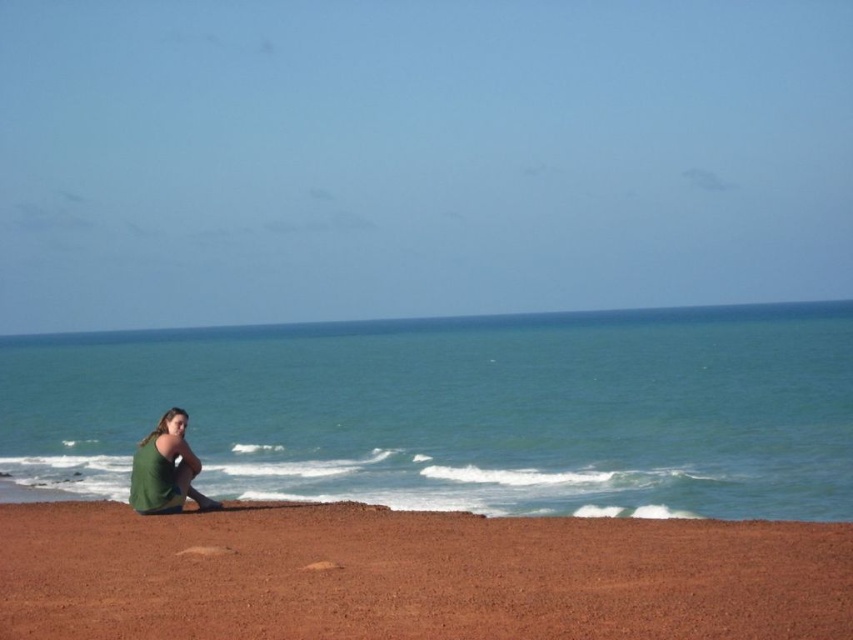
Can you confirm if green water at center is bigger than reddish-brown gravel at lower center?

Yes, green water at center is bigger than reddish-brown gravel at lower center.

Which is above, green water at center or reddish-brown gravel at lower center?

green water at center

This screenshot has height=640, width=853. Find the location of `green water at center`. green water at center is located at coordinates click(461, 412).

What do you see at coordinates (413, 576) in the screenshot?
I see `reddish-brown gravel at lower center` at bounding box center [413, 576].

Between reddish-brown gravel at lower center and green fabric at lower left, which one is positioned higher?

Positioned higher is green fabric at lower left.

Does point (268, 630) come behind point (198, 460)?

No, (268, 630) is in front of (198, 460).

The height and width of the screenshot is (640, 853). I want to click on reddish-brown gravel at lower center, so click(x=413, y=576).

Who is more distant from viewer, (125, 456) or (134, 468)?

The point (125, 456) is behind.

Is point (740, 376) farther from viewer compared to point (193, 467)?

Yes, point (740, 376) is farther from viewer.

Locate an element on the screen. Image resolution: width=853 pixels, height=640 pixels. green water at center is located at coordinates (461, 412).